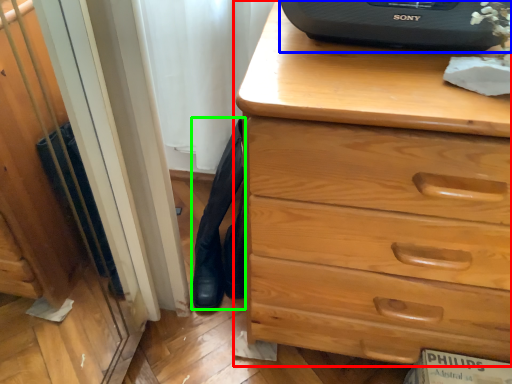
Question: Estimate the real-world distances between objects in this image. Which object is closer to chest of drawers (highlighted by a red box), desktop computer (highlighted by a blue box) or tight (highlighted by a green box)?

Choices:
 (A) desktop computer
 (B) tight

Answer: (A)